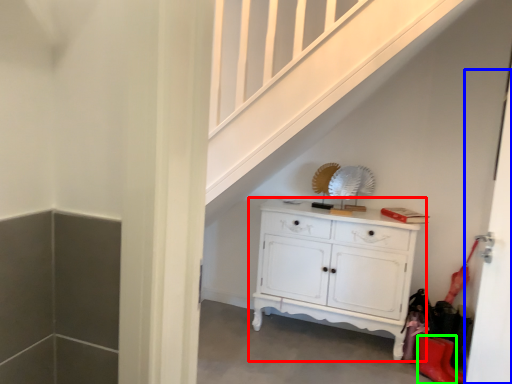
Question: Based on their relative distances, which object is farther from chest of drawers (highlighted by a red box)? Choose from door (highlighted by a blue box) and shoe (highlighted by a green box).

Choices:
 (A) door
 (B) shoe

Answer: (A)